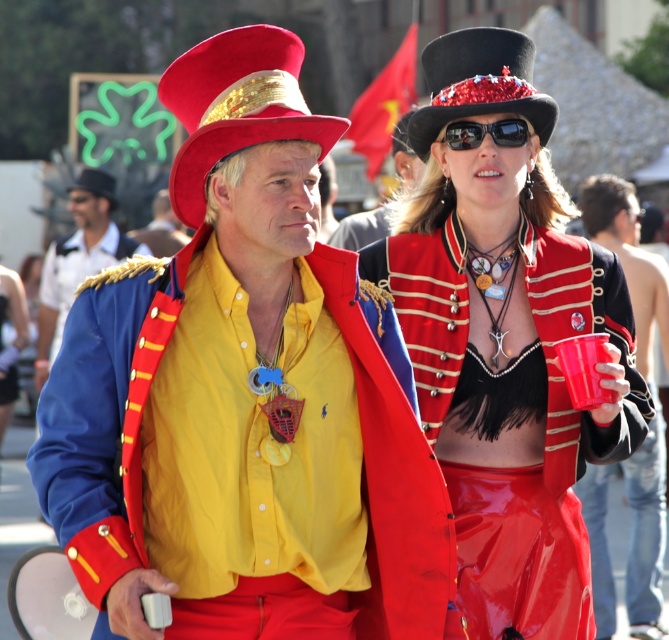
You are a photographer at the event and want to ensure both the matte gold hat at upper center and the shiny red skirt at center are clearly visible in your photo. Given their sizes, which one might you need to adjust your camera angle for to avoid it being too large in the frame?

The matte gold hat at upper center is much taller than the shiny red skirt at center, so you might need to adjust your camera angle to avoid the matte gold hat at upper center from appearing too large in the frame.

Based on the coordinates provided, can you identify which object corresponds to the point at (246, 396)?

The shiny red coat at center corresponds to the point at (246, 396).